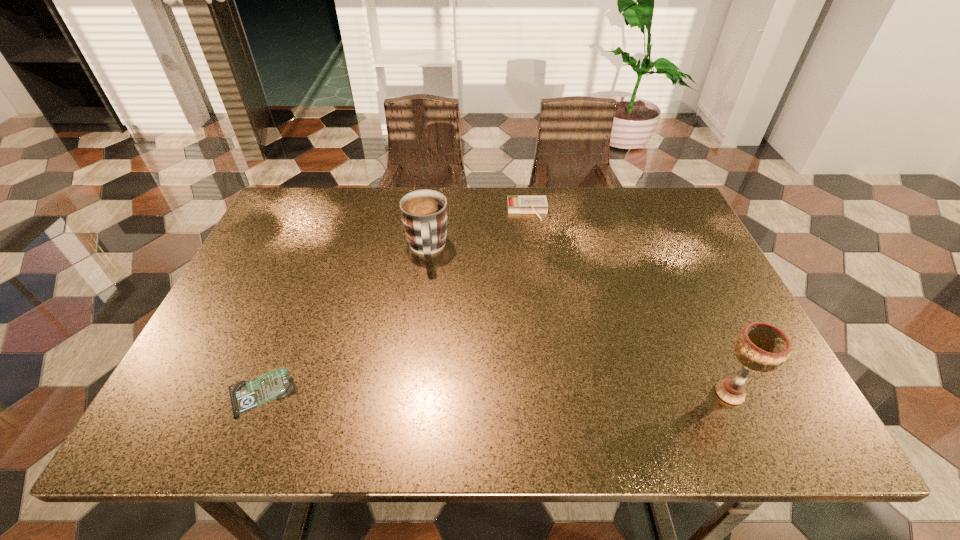
This screenshot has width=960, height=540. In order to click on identity card in this screenshot , I will do `click(245, 395)`.

The width and height of the screenshot is (960, 540). What are the coordinates of `the leftmost object` in the screenshot? It's located at (245, 395).

Locate an element on the screen. Image resolution: width=960 pixels, height=540 pixels. chalice is located at coordinates (761, 347).

The image size is (960, 540). I want to click on the tallest object, so click(761, 347).

Locate an element on the screen. the third object from right to left is located at coordinates (424, 214).

This screenshot has width=960, height=540. I want to click on mug, so click(x=424, y=214).

At what (x,y) coordinates should I click in order to perform the action: click on matchbox. Please return your answer as a coordinate pair (x, y). Looking at the image, I should click on (516, 204).

At what (x,y) coordinates should I click in order to perform the action: click on the farthest object. Please return your answer as a coordinate pair (x, y). The height and width of the screenshot is (540, 960). Looking at the image, I should click on (516, 204).

The image size is (960, 540). I want to click on vacant region located 0.210m on the back of the identity card, so click(x=300, y=295).

At what (x,y) coordinates should I click in order to perform the action: click on vacant space positioned on the left of the tallest object. Please return your answer as a coordinate pair (x, y). Looking at the image, I should click on (574, 393).